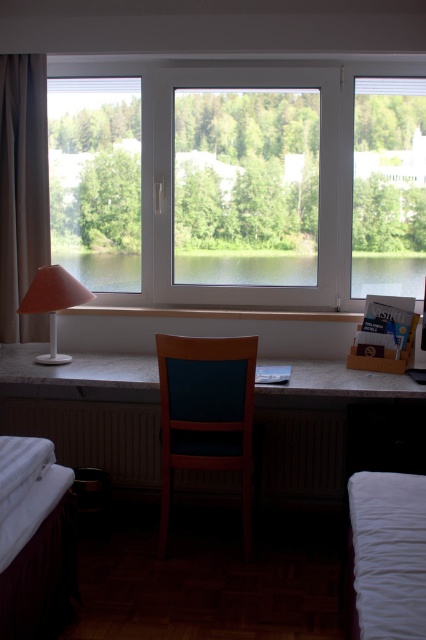
You are standing in the hotel room and want to reach the point marked at coordinates (201,376). If your walking distance is limited to 10 feet, can you comfortably reach that point from your current position?

The distance between you and the point marked at coordinates (201,376) is 8.72 feet, which is within your 10 feet walking limit. Therefore, you can comfortably reach that point.

You are a guest in this hotel room and need to decide whether to place a tall plant next to the wooden chair at center. Considering the height of the beige fabric curtain at left, do you think the plant will be shorter than the curtain?

The wooden chair at center is not as tall as the beige fabric curtain at left, so if the plant is placed next to the wooden chair at center, it will be shorter than the curtain as long as the plant is not taller than the chair.

You are standing in the hotel room and need to move from the wooden chair at center to the matte orange lampshade at left. Which direction should you move?

You should move to the left because the wooden chair at center is to the right of the matte orange lampshade at left.